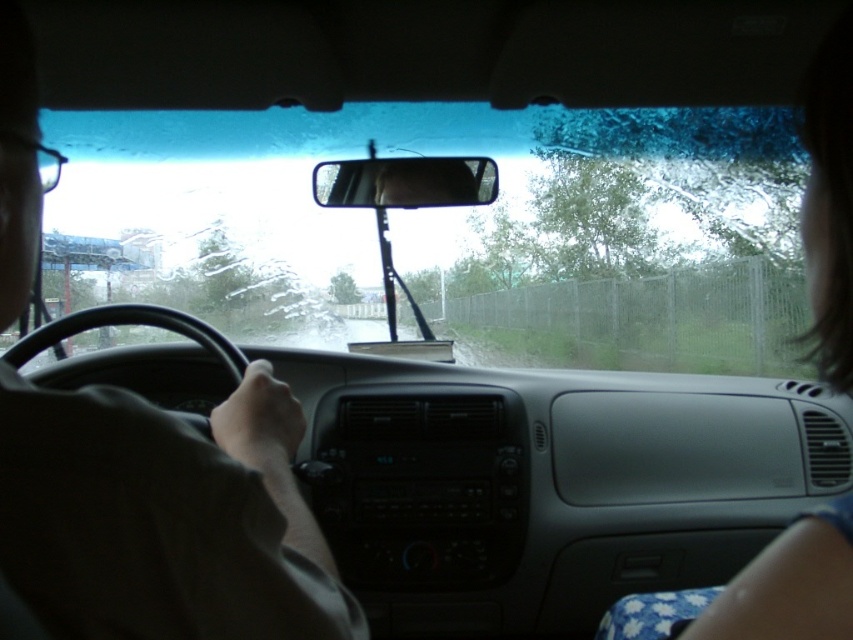
Based on the photo, you are a passenger in the vehicle and need to determine if the transparent glass windshield at center can fully cover the matte black steering wheel at left when looking forward. Based on their widths, can the windshield cover the steering wheel?

The transparent glass windshield at center might be wider than matte black steering wheel at left, so it could potentially cover it depending on their exact widths.

You are driving a car and need to check your blind spot. You have to look past the matte black steering wheel at left and the clear plastic view mirror at center. Which object should you move first to get a better view?

The matte black steering wheel at left is positioned on the left side of the clear plastic view mirror at center. To check your blind spot, you should move the clear plastic view mirror at center first since it is closer to the center and might obstruct your view when looking over your shoulder.

You are a passenger in the car and want to check the rearview mirror. Which object is positioned higher between the matte black steering wheel at left and the clear plastic view mirror at center?

The clear plastic view mirror at center is positioned higher than the matte black steering wheel at left.